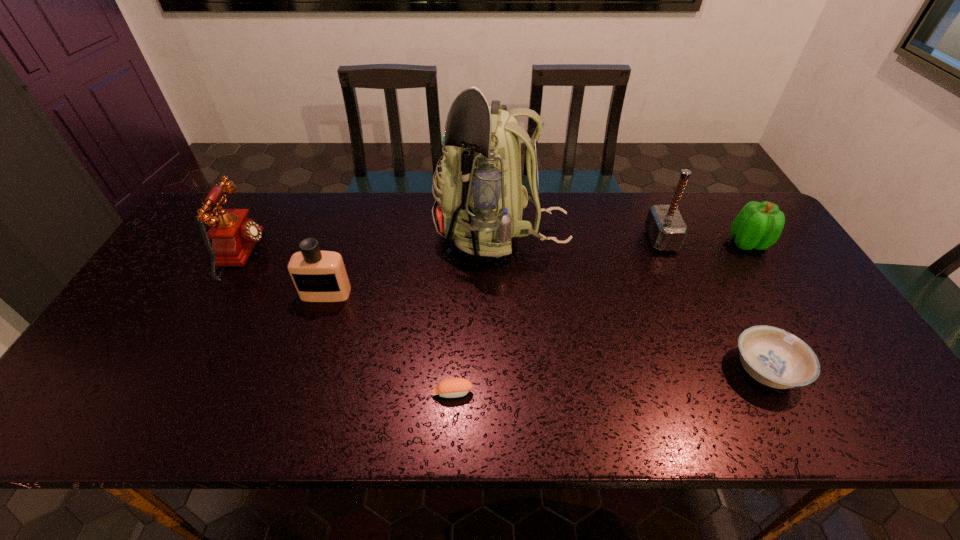
Locate an element on the screen. telephone that is at the far edge is located at coordinates (233, 235).

Find the location of a particular element. The width and height of the screenshot is (960, 540). bell pepper located at the far edge is located at coordinates (758, 225).

This screenshot has width=960, height=540. In order to click on bowl located at the near edge in this screenshot , I will do `click(774, 357)`.

Where is `sushi located in the near edge section of the desktop`? sushi located in the near edge section of the desktop is located at coordinates (451, 387).

The image size is (960, 540). I want to click on object present at the left edge, so click(233, 235).

Locate an element on the screen. The height and width of the screenshot is (540, 960). bell pepper located at the right edge is located at coordinates (758, 225).

Locate an element on the screen. This screenshot has height=540, width=960. bowl that is at the right edge is located at coordinates (774, 357).

Locate an element on the screen. This screenshot has width=960, height=540. object at the far left corner is located at coordinates (233, 235).

I want to click on object present at the far right corner, so click(758, 225).

The height and width of the screenshot is (540, 960). Identify the location of object located in the near right corner section of the desktop. (774, 357).